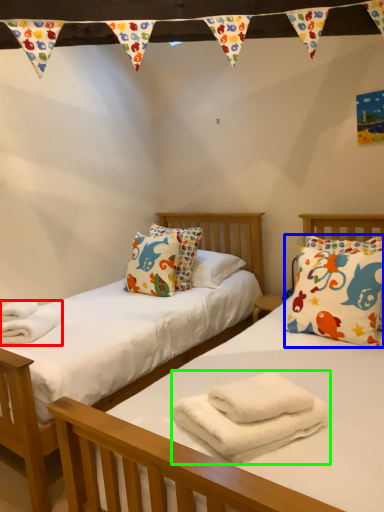
Question: Which is nearer to the material (highlighted by a red box)? pillow (highlighted by a blue box) or bath towel (highlighted by a green box).

Choices:
 (A) pillow
 (B) bath towel

Answer: (B)